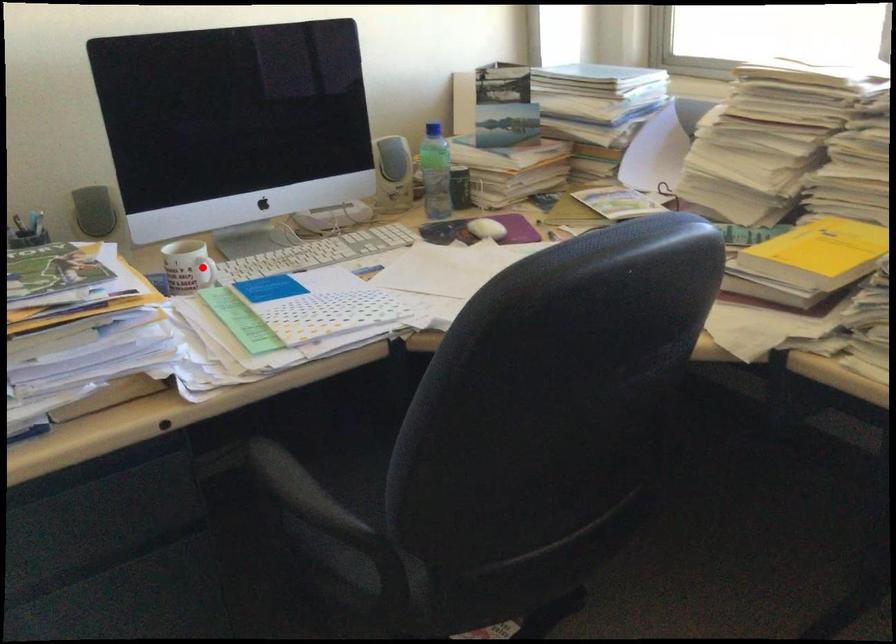
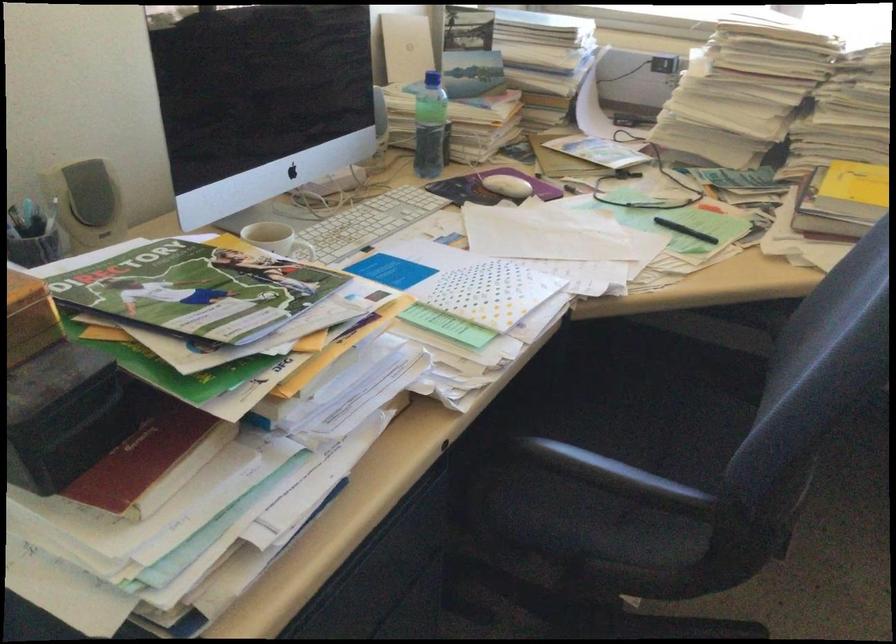
Question: I am providing you with two images of the same scene from different viewpoints. A red point is shown in image1. For the corresponding object point in image2, is it positioned nearer or farther from the camera?

Choices:
 (A) Nearer
 (B) Farther

Answer: (A)